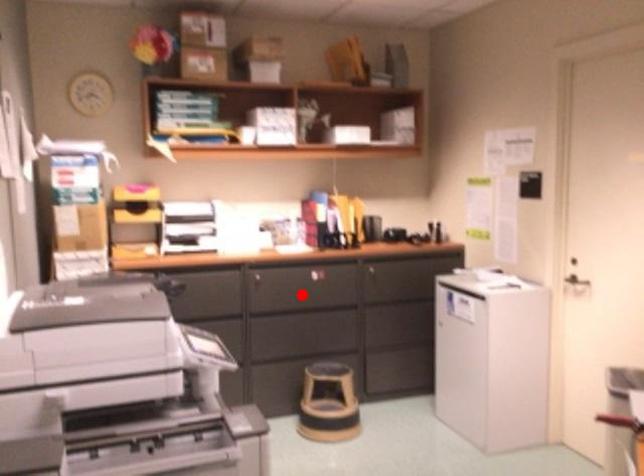
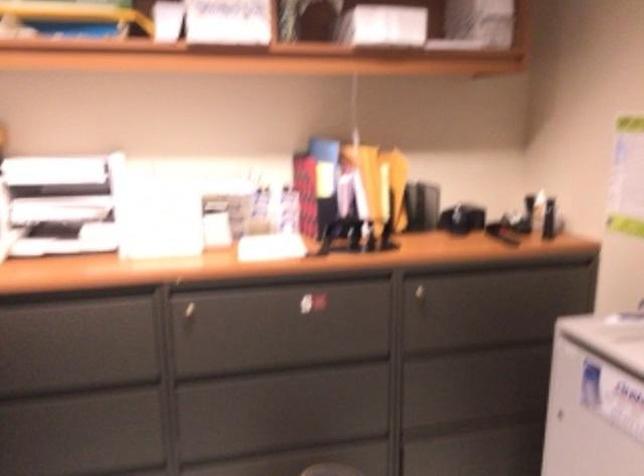
Question: I am providing you with two images of the same scene from different viewpoints. Image1 has a red point marked. In image2, the corresponding 3D location appears at what relative position? Reply with the corresponding letter.

Choices:
 (A) Closer
 (B) Farther

Answer: (A)